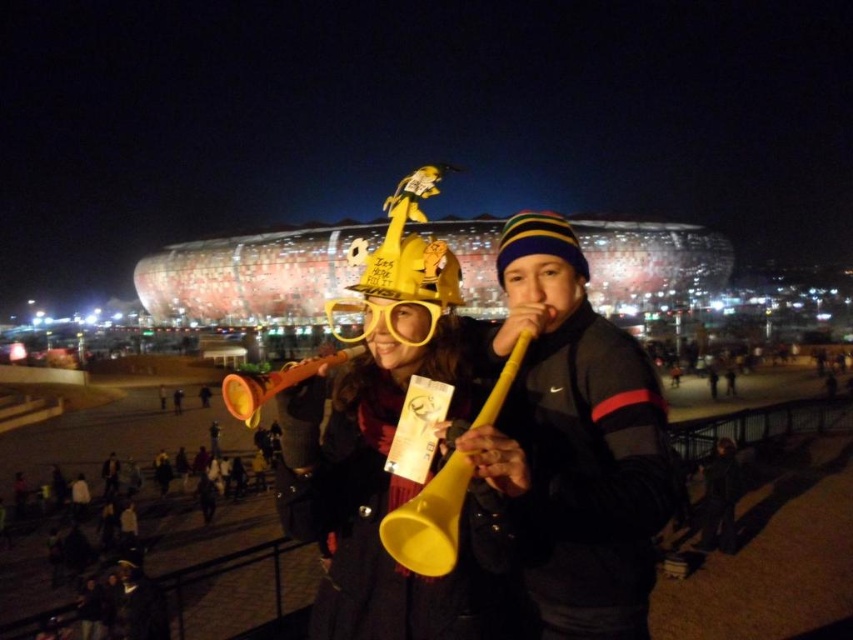
Question: Among these objects, which one is nearest to the camera?

Choices:
 (A) yellow plastic trumpet at center
 (B) dark gray fabric jacket at lower right

Answer: (A)

Question: Is yellow matte horn at center positioned in front of matte orange trumpet at center?

Choices:
 (A) yes
 (B) no

Answer: (A)

Question: From the image, what is the correct spatial relationship of yellow matte horn at center in relation to matte orange trumpet at center?

Choices:
 (A) below
 (B) above

Answer: (A)

Question: Which point is closer to the camera?

Choices:
 (A) dark gray fabric jacket at lower right
 (B) matte orange trumpet at center
 (C) yellow matte horn at center

Answer: (C)

Question: Which of these objects is positioned farthest from the dark gray fabric jacket at lower right?

Choices:
 (A) yellow matte horn at center
 (B) matte orange trumpet at center
 (C) yellow plastic trumpet at center

Answer: (B)

Question: Is yellow plastic trumpet at center to the right of matte orange trumpet at center from the viewer's perspective?

Choices:
 (A) no
 (B) yes

Answer: (B)